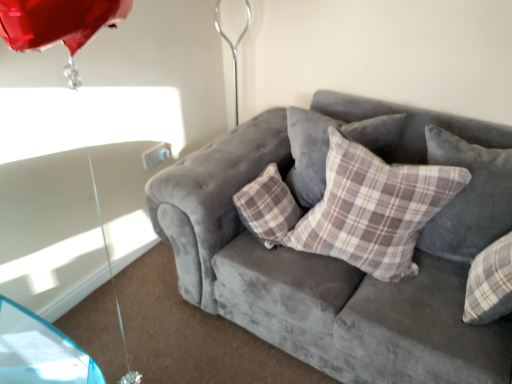
Question: From the image's perspective, is velvet gray couch at center located above plaid fabric pillow at center, acting as the 1th pillow starting from the left?

Choices:
 (A) no
 (B) yes

Answer: (A)

Question: From a real-world perspective, is velvet gray couch at center on top of plaid fabric pillow at center, acting as the third pillow starting from the right?

Choices:
 (A) yes
 (B) no

Answer: (B)

Question: Is velvet gray couch at center surrounding plaid fabric pillow at center, acting as the 1th pillow starting from the left?

Choices:
 (A) yes
 (B) no

Answer: (A)

Question: From the image's perspective, is velvet gray couch at center beneath plaid fabric pillow at center, acting as the third pillow starting from the right?

Choices:
 (A) no
 (B) yes

Answer: (B)

Question: Is velvet gray couch at center thinner than plaid fabric pillow at center, acting as the 1th pillow starting from the left?

Choices:
 (A) yes
 (B) no

Answer: (B)

Question: Based on their sizes in the image, would you say plaid fabric pillow at center, which is the 3th pillow in left-to-right order, is bigger or smaller than velvet gray couch at center?

Choices:
 (A) big
 (B) small

Answer: (B)

Question: Would you say plaid fabric pillow at center, the first pillow from the right, is to the left or to the right of velvet gray couch at center in the picture?

Choices:
 (A) left
 (B) right

Answer: (B)

Question: Considering the positions of point (471, 235) and point (263, 142), is point (471, 235) closer or farther from the camera than point (263, 142)?

Choices:
 (A) farther
 (B) closer

Answer: (B)

Question: From a real-world perspective, relative to velvet gray couch at center, is plaid fabric pillow at center, the first pillow from the right, vertically above or below?

Choices:
 (A) below
 (B) above

Answer: (B)

Question: Considering the positions of plaid fabric pillow at center, which appears as the second pillow when viewed from the right, and plaid fabric pillow at center, the first pillow from the right, in the image, is plaid fabric pillow at center, which appears as the second pillow when viewed from the right, bigger or smaller than plaid fabric pillow at center, the first pillow from the right,?

Choices:
 (A) small
 (B) big

Answer: (B)

Question: Based on their positions, is plaid fabric pillow at center, which appears as the second pillow when viewed from the right, located to the left or right of plaid fabric pillow at center, the first pillow from the right?

Choices:
 (A) right
 (B) left

Answer: (B)

Question: In terms of height, does plaid fabric pillow at center, which appears as the second pillow when viewed from the right, look taller or shorter compared to plaid fabric pillow at center, which is the 3th pillow in left-to-right order?

Choices:
 (A) tall
 (B) short

Answer: (A)

Question: From a real-world perspective, is plaid fabric pillow at center, arranged as the second pillow when viewed from the left, above or below plaid fabric pillow at center, the first pillow from the right?

Choices:
 (A) above
 (B) below

Answer: (B)

Question: In the image, is plaid fabric pillow at center, the first pillow from the right, positioned in front of or behind plaid fabric pillow at center, acting as the 1th pillow starting from the left?

Choices:
 (A) front
 (B) behind

Answer: (A)

Question: Is plaid fabric pillow at center, the first pillow from the right, inside the boundaries of plaid fabric pillow at center, acting as the 1th pillow starting from the left, or outside?

Choices:
 (A) outside
 (B) inside

Answer: (A)